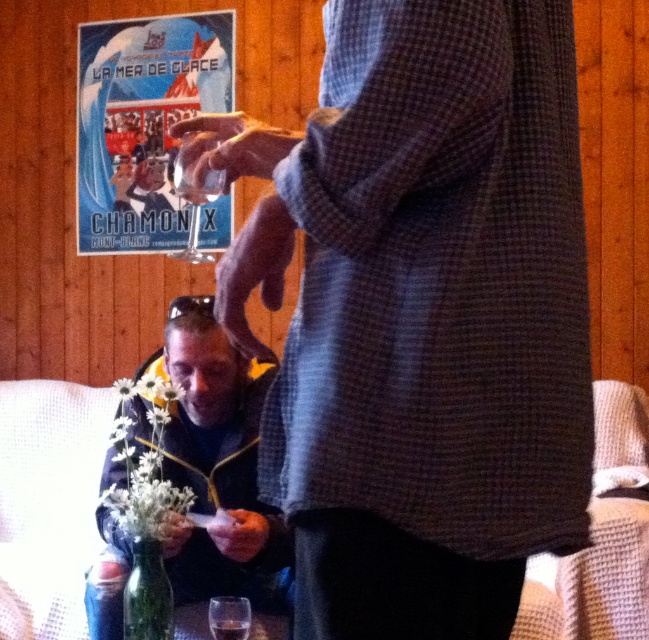
You are trying to place a new decorative item on the table between the dark blue jacket at lower left and the translucent glass at lower center. Which object should you move to make space?

The dark blue jacket at lower left might be wider than the translucent glass at lower center, so you should move the dark blue jacket at lower left to make space.

You are a photographer taking a picture of the scene. You need to focus on both the dark blue jacket at lower left and the translucent glass at lower center. Which object should you focus on first to ensure it appears sharp in the photo?

The dark blue jacket at lower left is closer to the viewer than the translucent glass at lower center, so you should focus on the dark blue jacket at lower left first to ensure it appears sharp in the photo.

Looking at this image, you are a photographer trying to capture a candid shot of the checkered fabric shirt at center. The camera is 73.54 centimeters away. Is this distance within the camera lens minimum focusing distance of 70 centimeters?

The checkered fabric shirt at center and camera are 73.54 centimeters apart. Since the minimum focusing distance is 70 centimeters, the camera can focus on the checkered fabric shirt at center as the distance is slightly beyond the minimum requirement.